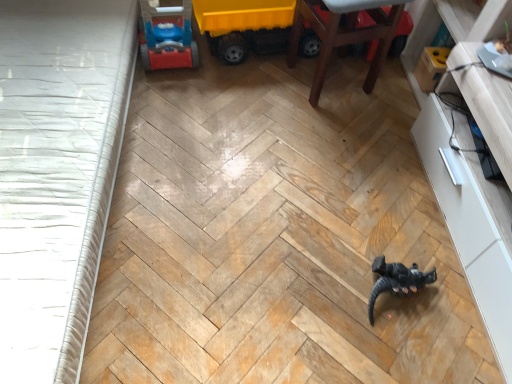
Find the location of `yellow plastic toy truck at upper center, which is the 2th toy in right-to-left order`. yellow plastic toy truck at upper center, which is the 2th toy in right-to-left order is located at coordinates (243, 26).

Based on the photo, measure the distance between wooden chair at upper right and camera.

wooden chair at upper right is 1.47 meters away from camera.

Locate an element on the screen. This screenshot has width=512, height=384. wooden chair at upper right is located at coordinates (345, 34).

I want to click on black matte dinosaur at center, which is the 2th toy in top-to-bottom order, so click(x=397, y=280).

Identify the location of yellow plastic toy truck at upper center, arranged as the 2th toy when ordered from the bottom. This screenshot has width=512, height=384. (243, 26).

Is wooden chair at upper right turned away from black matte dinosaur at center, positioned as the second toy in left-to-right order?

No.

Identify the location of toy that is on the right side of wooden chair at upper right. This screenshot has width=512, height=384. (397, 280).

From the image's perspective, who appears lower, wooden chair at upper right or black matte dinosaur at center, which is the 2th toy in top-to-bottom order?

black matte dinosaur at center, which is the 2th toy in top-to-bottom order.

Which of these two, wooden chair at upper right or black matte dinosaur at center, which is the 2th toy in top-to-bottom order, stands taller?

wooden chair at upper right.

Could you tell me if yellow plastic toy truck at upper center, which is the 1th toy from left to right, is facing black matte dinosaur at center, which is the 2th toy in top-to-bottom order?

Yes, yellow plastic toy truck at upper center, which is the 1th toy from left to right, is oriented towards black matte dinosaur at center, which is the 2th toy in top-to-bottom order.

Locate an element on the screen. This screenshot has width=512, height=384. toy lying behind the black matte dinosaur at center, positioned as the second toy in left-to-right order is located at coordinates pyautogui.click(x=243, y=26).

Is yellow plastic toy truck at upper center, acting as the first toy starting from the top, shorter than black matte dinosaur at center, which is the 2th toy in top-to-bottom order?

Incorrect, the height of yellow plastic toy truck at upper center, acting as the first toy starting from the top, does not fall short of that of black matte dinosaur at center, which is the 2th toy in top-to-bottom order.

Is yellow plastic toy truck at upper center, arranged as the 2th toy when ordered from the bottom, in contact with black matte dinosaur at center, the 1th toy when ordered from right to left?

No, yellow plastic toy truck at upper center, arranged as the 2th toy when ordered from the bottom, is not touching black matte dinosaur at center, the 1th toy when ordered from right to left.

Can you tell me how much white glossy dresser at right and black matte dinosaur at center, which is the 2th toy from back to front, differ in facing direction?

94.6 degrees.

Is point (494, 263) closer or farther from the camera than point (392, 292)?

Point (494, 263).

From the image's perspective, which one is positioned higher, white glossy dresser at right or black matte dinosaur at center, the first toy positioned from the bottom?

white glossy dresser at right is shown above in the image.

Could you tell me if white glossy dresser at right is facing black matte dinosaur at center, which is the 1th toy in front-to-back order?

Yes, white glossy dresser at right faces towards black matte dinosaur at center, which is the 1th toy in front-to-back order.

From a real-world perspective, between white glossy dresser at right and wooden chair at upper right, who is vertically higher?

In real-world perspective, wooden chair at upper right is above.

From the picture: In the image, is white glossy dresser at right positioned in front of or behind wooden chair at upper right?

white glossy dresser at right is positioned closer to the viewer than wooden chair at upper right.

Which of these two, white glossy dresser at right or wooden chair at upper right, is smaller?

wooden chair at upper right is smaller.

Is white glossy dresser at right positioned far away from wooden chair at upper right?

No.

Who is taller, yellow plastic toy truck at upper center, acting as the first toy starting from the top, or white glossy dresser at right?

white glossy dresser at right.

From the image's perspective, is yellow plastic toy truck at upper center, which is the 1th toy in back-to-front order, beneath white glossy dresser at right?

Actually, yellow plastic toy truck at upper center, which is the 1th toy in back-to-front order, appears above white glossy dresser at right in the image.

Is there a large distance between yellow plastic toy truck at upper center, which is the 1th toy from left to right, and white glossy dresser at right?

No, yellow plastic toy truck at upper center, which is the 1th toy from left to right, is in close proximity to white glossy dresser at right.

Is yellow plastic toy truck at upper center, which is the 1th toy from left to right, spatially inside white glossy dresser at right, or outside of it?

yellow plastic toy truck at upper center, which is the 1th toy from left to right, exists outside the volume of white glossy dresser at right.

Is yellow plastic toy truck at upper center, which appears as the second toy when viewed from the front, surrounded by white glossy dresser at right?

That's incorrect, yellow plastic toy truck at upper center, which appears as the second toy when viewed from the front, is not inside white glossy dresser at right.

Is white glossy dresser at right oriented towards yellow plastic toy truck at upper center, acting as the first toy starting from the top?

No.

Which point is more distant from viewer, (450, 194) or (254, 5)?

The point (254, 5) is farther.

Is white glossy dresser at right shorter than yellow plastic toy truck at upper center, which appears as the second toy when viewed from the front?

In fact, white glossy dresser at right may be taller than yellow plastic toy truck at upper center, which appears as the second toy when viewed from the front.

In the image, is white textured bed frame at left positioned in front of or behind black matte dinosaur at center, which is the 2th toy in top-to-bottom order?

In the image, white textured bed frame at left appears in front of black matte dinosaur at center, which is the 2th toy in top-to-bottom order.

Would you say white textured bed frame at left contains black matte dinosaur at center, positioned as the second toy in left-to-right order?

That's incorrect, black matte dinosaur at center, positioned as the second toy in left-to-right order, is not inside white textured bed frame at left.

From a real-world perspective, is white textured bed frame at left on top of black matte dinosaur at center, which is the 2th toy from back to front?

Yes, from a real-world perspective, white textured bed frame at left is over black matte dinosaur at center, which is the 2th toy from back to front

Measure the distance from white textured bed frame at left to black matte dinosaur at center, the first toy positioned from the bottom.

1.09 meters.

Identify the location of toy lying in front of the wooden chair at upper right. The width and height of the screenshot is (512, 384). (397, 280).

The image size is (512, 384). Find the location of `toy that is above the black matte dinosaur at center, which is the 2th toy in top-to-bottom order (from a real-world perspective)`. toy that is above the black matte dinosaur at center, which is the 2th toy in top-to-bottom order (from a real-world perspective) is located at coordinates (243, 26).

Which object lies further to the anchor point yellow plastic toy truck at upper center, acting as the first toy starting from the top, black matte dinosaur at center, which is the 2th toy in top-to-bottom order, or white glossy dresser at right?

black matte dinosaur at center, which is the 2th toy in top-to-bottom order.

Looking at the image, which one is located further to black matte dinosaur at center, which is the 2th toy from back to front, white glossy dresser at right or yellow plastic toy truck at upper center, arranged as the 2th toy when ordered from the bottom?

The object further to black matte dinosaur at center, which is the 2th toy from back to front, is yellow plastic toy truck at upper center, arranged as the 2th toy when ordered from the bottom.

When comparing their distances from white glossy dresser at right, does yellow plastic toy truck at upper center, acting as the first toy starting from the top, or wooden chair at upper right seem closer?

wooden chair at upper right lies closer to white glossy dresser at right than the other object.

Which object lies nearer to the anchor point white textured bed frame at left, yellow plastic toy truck at upper center, which is the 1th toy in back-to-front order, or wooden chair at upper right?

Based on the image, yellow plastic toy truck at upper center, which is the 1th toy in back-to-front order, appears to be nearer to white textured bed frame at left.

Considering their positions, is yellow plastic toy truck at upper center, which is the 2th toy in right-to-left order, positioned closer to black matte dinosaur at center, which is the 2th toy in top-to-bottom order, than white textured bed frame at left?

Based on the image, yellow plastic toy truck at upper center, which is the 2th toy in right-to-left order, appears to be nearer to black matte dinosaur at center, which is the 2th toy in top-to-bottom order.

Which object lies nearer to the anchor point wooden chair at upper right, white glossy dresser at right or white textured bed frame at left?

white glossy dresser at right is positioned closer to the anchor wooden chair at upper right.

Which object lies nearer to the anchor point yellow plastic toy truck at upper center, acting as the first toy starting from the top, wooden chair at upper right or black matte dinosaur at center, which is the 2th toy from back to front?

The object closer to yellow plastic toy truck at upper center, acting as the first toy starting from the top, is wooden chair at upper right.

Which object lies further to the anchor point white textured bed frame at left, yellow plastic toy truck at upper center, which is the 2th toy in right-to-left order, or white glossy dresser at right?

The object further to white textured bed frame at left is white glossy dresser at right.

This screenshot has width=512, height=384. What are the coordinates of `furniture between white textured bed frame at left and white glossy dresser at right in the horizontal direction` in the screenshot? It's located at (345, 34).

Find the location of a particular element. The height and width of the screenshot is (384, 512). furniture that lies between yellow plastic toy truck at upper center, which is the 2th toy in right-to-left order, and black matte dinosaur at center, the first toy positioned from the bottom, from top to bottom is located at coordinates (345, 34).

Locate an element on the screen. Image resolution: width=512 pixels, height=384 pixels. toy situated between white textured bed frame at left and wooden chair at upper right from left to right is located at coordinates (243, 26).

Where is `dresser between wooden chair at upper right and black matte dinosaur at center, positioned as the second toy in left-to-right order, vertically`? This screenshot has height=384, width=512. dresser between wooden chair at upper right and black matte dinosaur at center, positioned as the second toy in left-to-right order, vertically is located at coordinates (472, 225).